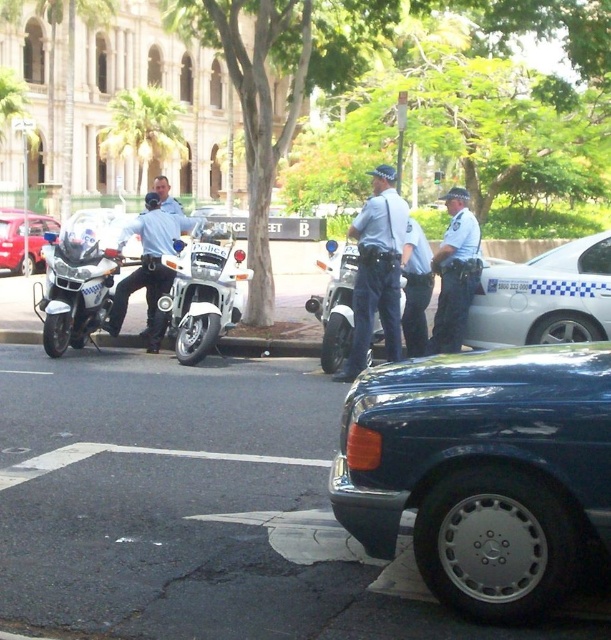
Question: Is metallic blue sedan at center bigger than white checkered car at center-right?

Choices:
 (A) no
 (B) yes

Answer: (B)

Question: Can you confirm if metallic blue sedan at center is wider than metallic red sedan at left?

Choices:
 (A) no
 (B) yes

Answer: (A)

Question: Which of these objects is positioned closest to the metallic red sedan at left?

Choices:
 (A) matte black motorcycle at left
 (B) polished chrome motorcycle at left

Answer: (B)

Question: Is blue uniformed officer at center bigger than light blue uniform at center?

Choices:
 (A) yes
 (B) no

Answer: (A)

Question: Among these points, which one is nearest to the camera?

Choices:
 (A) (207, 244)
 (B) (16, 264)

Answer: (A)

Question: Which point is closer to the camera?

Choices:
 (A) light blue uniform at center
 (B) white glossy motorcycle at center
 (C) metallic blue sedan at center

Answer: (C)